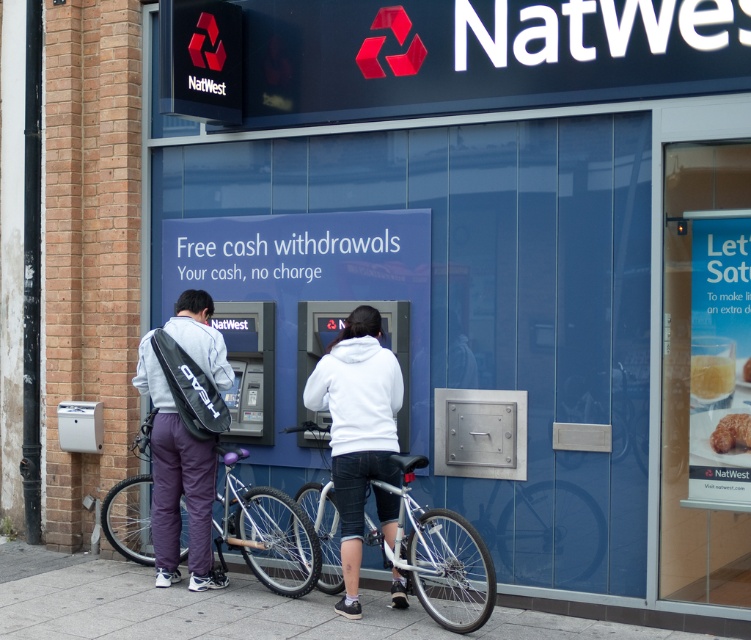
You are standing at point (746,378) and want to walk to point (201,529). Based on the image, which direction should you move?

You should move forward because point (201,529) is behind point (746,378), so moving in the direction away from the starting point will reach the destination.

You are a delivery person who needs to place a gray fabric backpack at center and a golden crispy croissant at center on a delivery table. The table is 3 meters long. Can both items fit on the table without overlapping?

The gray fabric backpack at center is 3.62 meters away from the golden crispy croissant at center. Since the distance between them is greater than the table length of 3 meters, they cannot both fit on the table without overlapping.

You are a delivery person who needs to secure your silver metallic bicycle at center and gray fabric backpack at center near the NatWest bank branch. Based on their positions, where should you place the bicycle and backpack to ensure they are both visible from the main entrance?

The silver metallic bicycle at center should be placed below the gray fabric backpack at center so that the backpack is above the bicycle, making both items visible from the main entrance.